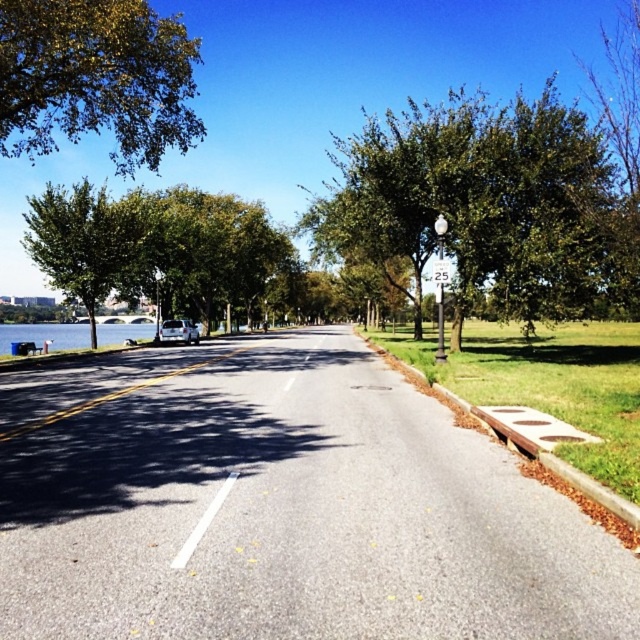
Question: Which of the following is the closest to the observer?

Choices:
 (A) green plastic sign at center
 (B) green leafy tree at center
 (C) white plastic sign at center

Answer: (B)

Question: Estimate the real-world distances between objects in this image. Which object is farther from the green leafy tree at upper left?

Choices:
 (A) green plastic sign at center
 (B) green leafy tree at left
 (C) white plastic sign at center

Answer: (C)

Question: From the image, what is the correct spatial relationship of green leafy tree at upper left in relation to green leafy tree at left?

Choices:
 (A) below
 (B) above

Answer: (B)

Question: Where is green leafy tree at left located in relation to green plastic sign at center in the image?

Choices:
 (A) left
 (B) right

Answer: (A)

Question: Among these points, which one is farthest from the camera?

Choices:
 (A) (435, 269)
 (B) (381, 141)
 (C) (122, 236)
 (D) (180, 147)

Answer: (C)

Question: Does green leafy tree at left have a larger size compared to white plastic sign at center?

Choices:
 (A) yes
 (B) no

Answer: (A)